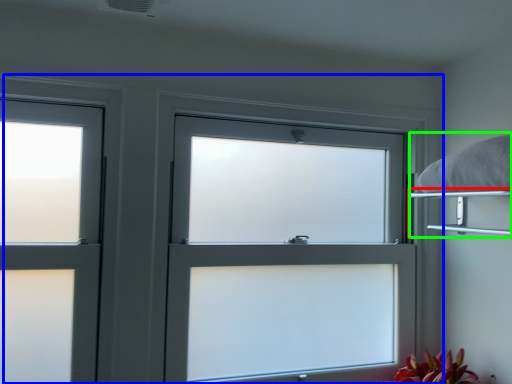
Question: Which is farther away from shelf (highlighted by a red box)? window (highlighted by a blue box) or bed (highlighted by a green box)?

Choices:
 (A) window
 (B) bed

Answer: (A)